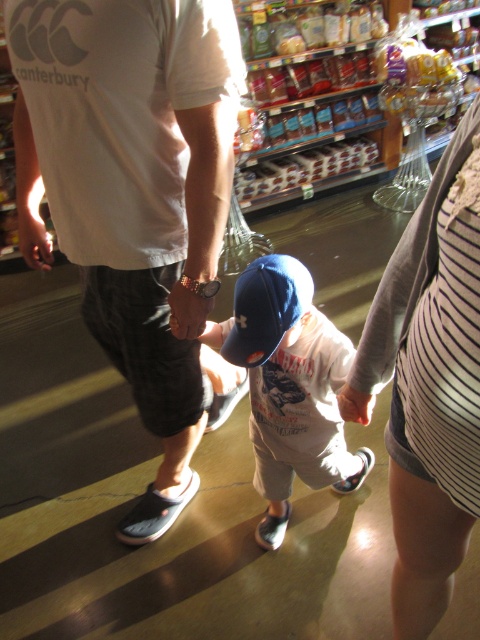
You are a customer in the grocery store and you see a child holding hands with two adults. The child is wearing a matte blue cap at center and has a striped fabric shirt at center. Which clothing item is positioned to the right of the other?

The striped fabric shirt at center is to the right of the matte blue cap at center.

You are a store employee who needs to arrange a display. You have a striped fabric shirt at center and a blue fabric cap at center. According to the scene, which item should be placed higher to match the original arrangement?

The blue fabric cap at center should be placed higher than the striped fabric shirt at center because in the original scene, the striped fabric shirt at center is positioned under the blue fabric cap at center.